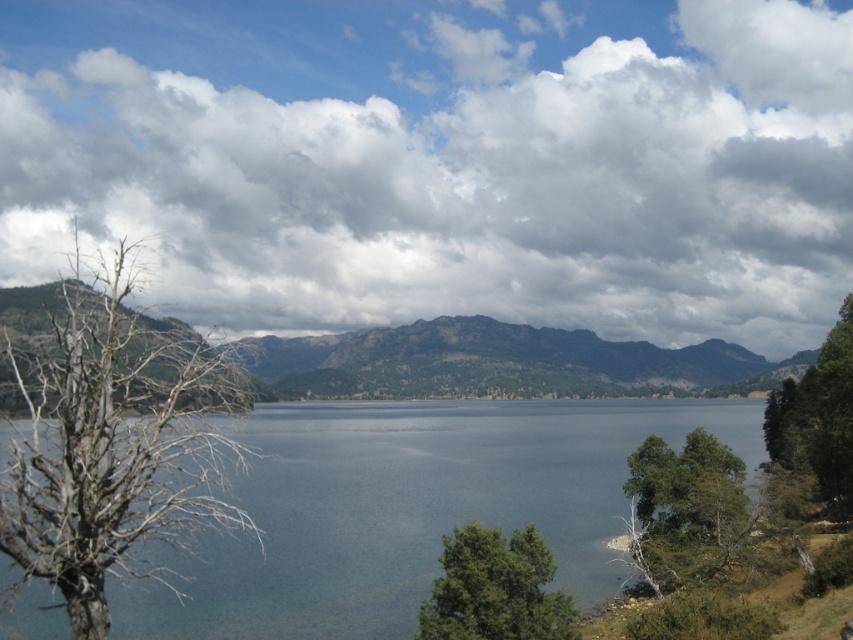
Question: Does rugged brown mountain at center appear over green leafy tree at lower right?

Choices:
 (A) yes
 (B) no

Answer: (B)

Question: Which of the following is the closest to the observer?

Choices:
 (A) cloudy sky at upper center
 (B) clear water at center

Answer: (B)

Question: Which object is closer to the camera taking this photo?

Choices:
 (A) cloudy sky at upper center
 (B) green leafy tree at lower right
 (C) green leafy tree at lower center
 (D) clear water at center

Answer: (D)

Question: Which is nearer to the bare wood tree at left?

Choices:
 (A) green leafy tree at right
 (B) green leafy tree at lower right
 (C) clear water at center
 (D) rugged brown mountain at center

Answer: (B)

Question: Does cloudy sky at upper center come in front of green leafy tree at right?

Choices:
 (A) yes
 (B) no

Answer: (A)

Question: Can you confirm if rugged brown mountain at center is positioned to the left of green leafy tree at right?

Choices:
 (A) yes
 (B) no

Answer: (B)